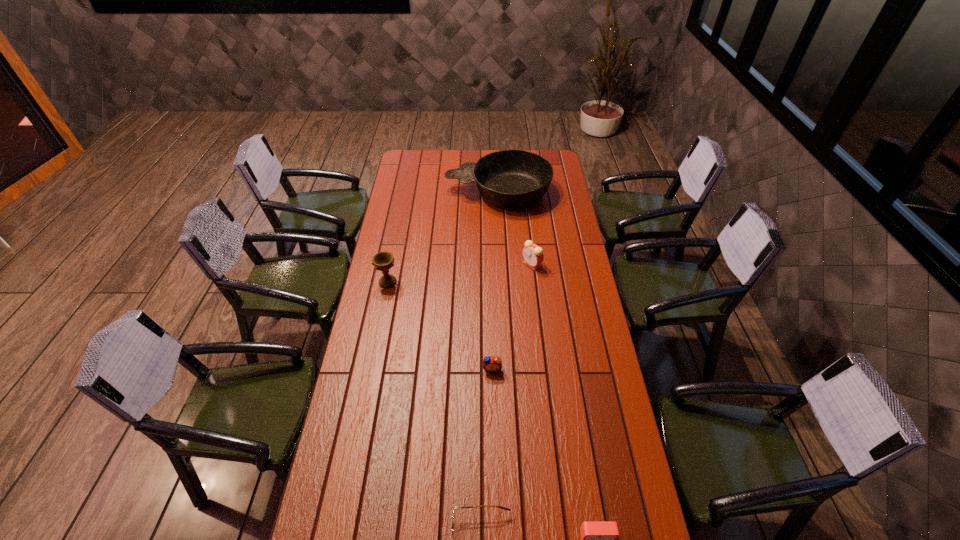
This screenshot has width=960, height=540. I want to click on frying pan, so click(512, 179).

This screenshot has height=540, width=960. I want to click on the third farthest object, so click(383, 261).

Image resolution: width=960 pixels, height=540 pixels. I want to click on chalice, so click(383, 261).

Where is `the second alarm clock from left to right`? The width and height of the screenshot is (960, 540). the second alarm clock from left to right is located at coordinates [533, 255].

The image size is (960, 540). I want to click on the tallest alarm clock, so click(533, 255).

Where is `the second nearest alarm clock`? The width and height of the screenshot is (960, 540). the second nearest alarm clock is located at coordinates (492, 364).

This screenshot has height=540, width=960. In order to click on the third shortest object in this screenshot , I will do `click(492, 364)`.

I want to click on vacant space positioned with the handle extending from the side of the farthest object, so click(x=426, y=193).

The height and width of the screenshot is (540, 960). What are the coordinates of `vacant point located 0.270m with the handle extending from the side of the farthest object` in the screenshot? It's located at (395, 193).

I want to click on vacant space located with the handle extending from the side of the farthest object, so click(420, 193).